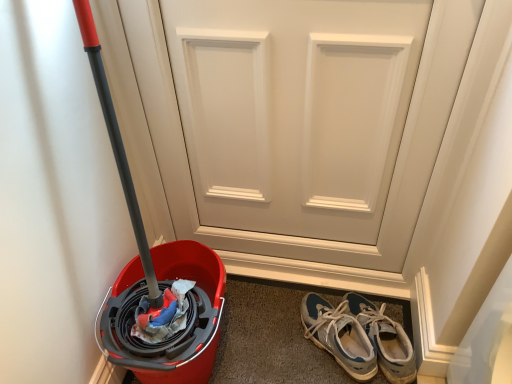
Question: Is blue suede sneakers at lower right, which is the 2th footwear in left-to-right order, facing towards white matte door at center?

Choices:
 (A) no
 (B) yes

Answer: (A)

Question: Is white matte door at center completely or partially inside blue suede sneakers at lower right, the 1th footwear in the right-to-left sequence?

Choices:
 (A) yes
 (B) no

Answer: (B)

Question: Considering the relative sizes of blue suede sneakers at lower right, the 1th footwear in the right-to-left sequence, and white matte door at center in the image provided, is blue suede sneakers at lower right, the 1th footwear in the right-to-left sequence, thinner than white matte door at center?

Choices:
 (A) no
 (B) yes

Answer: (A)

Question: Is blue suede sneakers at lower right, the 1th footwear in the right-to-left sequence, positioned far away from white matte door at center?

Choices:
 (A) yes
 (B) no

Answer: (B)

Question: Does blue suede sneakers at lower right, which is the 2th footwear in left-to-right order, appear on the left side of white matte door at center?

Choices:
 (A) no
 (B) yes

Answer: (A)

Question: Is blue suede sneakers at lower right, which is the 2th footwear in left-to-right order, in front of white matte door at center?

Choices:
 (A) yes
 (B) no

Answer: (B)

Question: Does blue suede sneakers at lower right, the 1th footwear positioned from the left, lie in front of blue suede sneakers at lower right, the 1th footwear in the right-to-left sequence?

Choices:
 (A) yes
 (B) no

Answer: (A)

Question: Is blue suede sneakers at lower right, the 1th footwear positioned from the left, thinner than blue suede sneakers at lower right, which is the 2th footwear in left-to-right order?

Choices:
 (A) yes
 (B) no

Answer: (A)

Question: Is blue suede sneakers at lower right, the 1th footwear positioned from the left, bigger than blue suede sneakers at lower right, which is the 2th footwear in left-to-right order?

Choices:
 (A) yes
 (B) no

Answer: (B)

Question: Is blue suede sneakers at lower right, the second footwear from the right, behind blue suede sneakers at lower right, which is the 2th footwear in left-to-right order?

Choices:
 (A) yes
 (B) no

Answer: (B)

Question: From a real-world perspective, is blue suede sneakers at lower right, the second footwear from the right, located higher than blue suede sneakers at lower right, which is the 2th footwear in left-to-right order?

Choices:
 (A) no
 (B) yes

Answer: (B)

Question: Is there a large distance between blue suede sneakers at lower right, the second footwear from the right, and blue suede sneakers at lower right, the 1th footwear in the right-to-left sequence?

Choices:
 (A) yes
 (B) no

Answer: (B)

Question: Considering the relative positions of white matte door at center and blue suede sneakers at lower right, the second footwear from the right, in the image provided, is white matte door at center to the right of blue suede sneakers at lower right, the second footwear from the right, from the viewer's perspective?

Choices:
 (A) yes
 (B) no

Answer: (B)